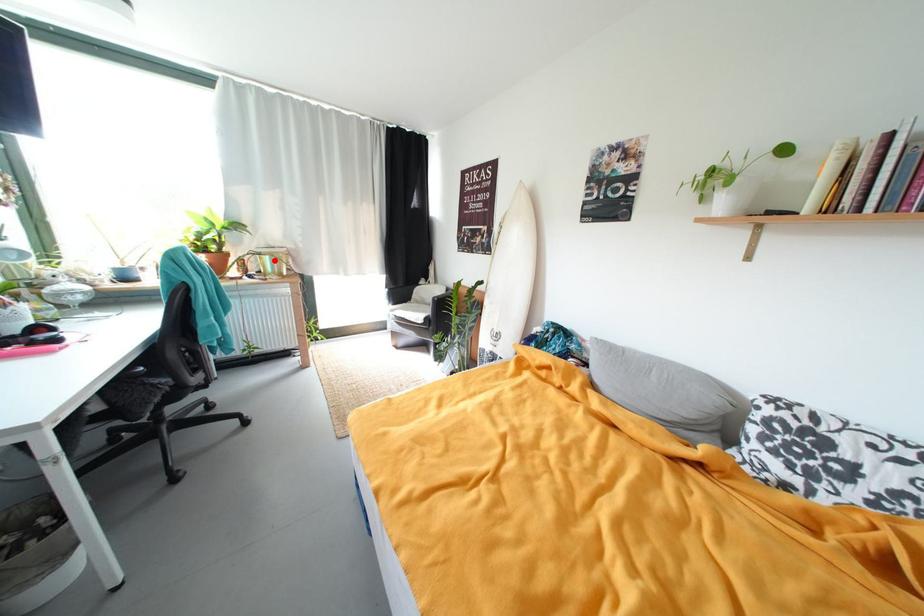
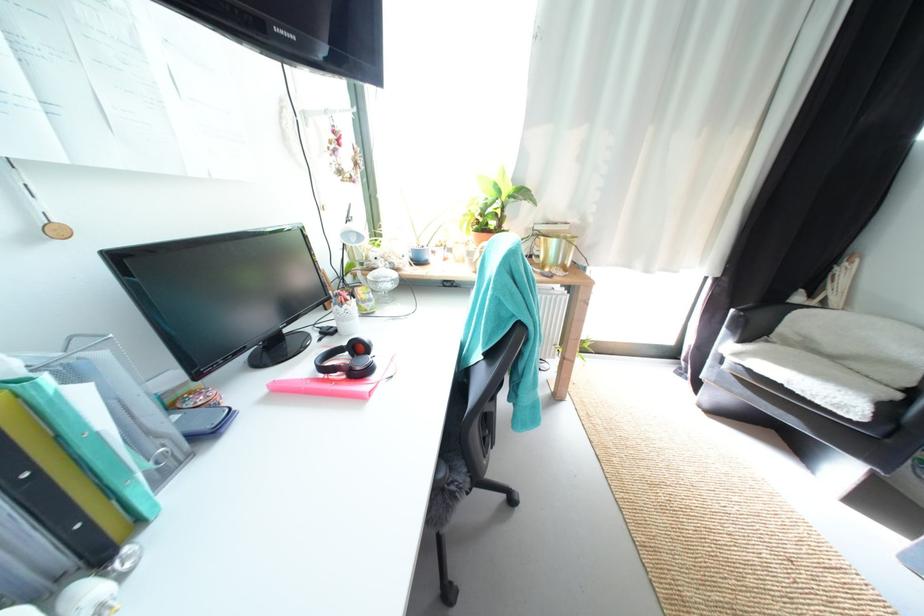
Locate, in the second image, the point that corresponds to the highlighted location in the first image.

(562, 244)